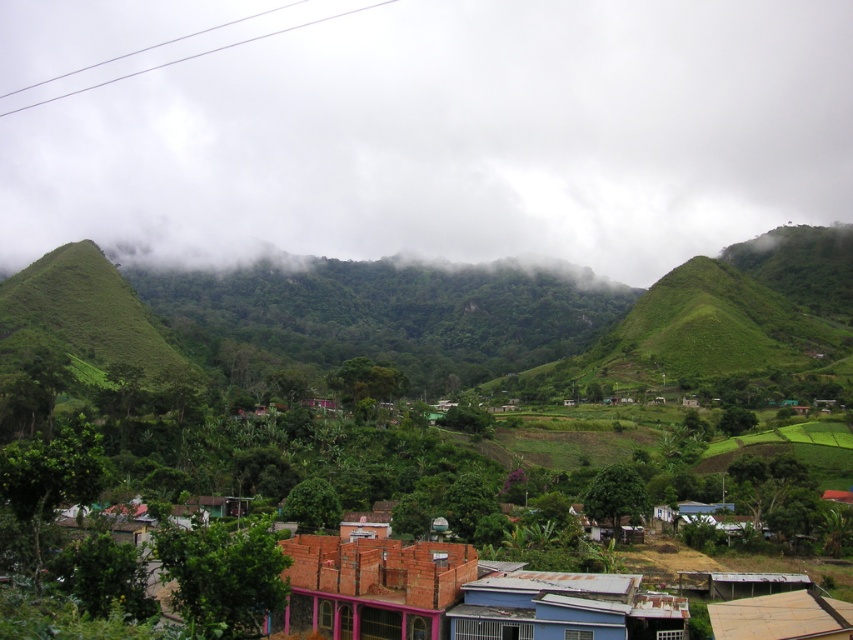
Question: Can you confirm if green leafy hillside at upper center is smaller than brick house at center?

Choices:
 (A) no
 (B) yes

Answer: (A)

Question: Does brick house at center have a greater width compared to blue corrugated metal roof at center?

Choices:
 (A) no
 (B) yes

Answer: (B)

Question: Which of the following is the farthest from the observer?

Choices:
 (A) brown wooden hut at lower right
 (B) green leafy hillside at left

Answer: (B)

Question: Can you confirm if brick house at center is positioned to the left of green leafy hillside at left?

Choices:
 (A) no
 (B) yes

Answer: (A)

Question: Among these points, which one is farthest from the camera?

Choices:
 (A) (463, 636)
 (B) (691, 48)

Answer: (B)

Question: Among these points, which one is farthest from the camera?

Choices:
 (A) (798, 632)
 (B) (653, 10)
 (C) (358, 592)
 (D) (9, 368)

Answer: (B)